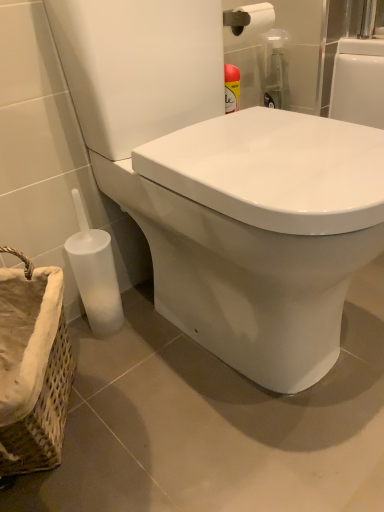
You are a GUI agent. You are given a task and a screenshot of the screen. Output one action in this format:
    pyautogui.click(x=<x>, y=<y>)
    Task: Click on the free spot to the right of white matte toilet brush at lower left
    The width and height of the screenshot is (384, 512).
    Given the screenshot: What is the action you would take?
    pyautogui.click(x=162, y=333)